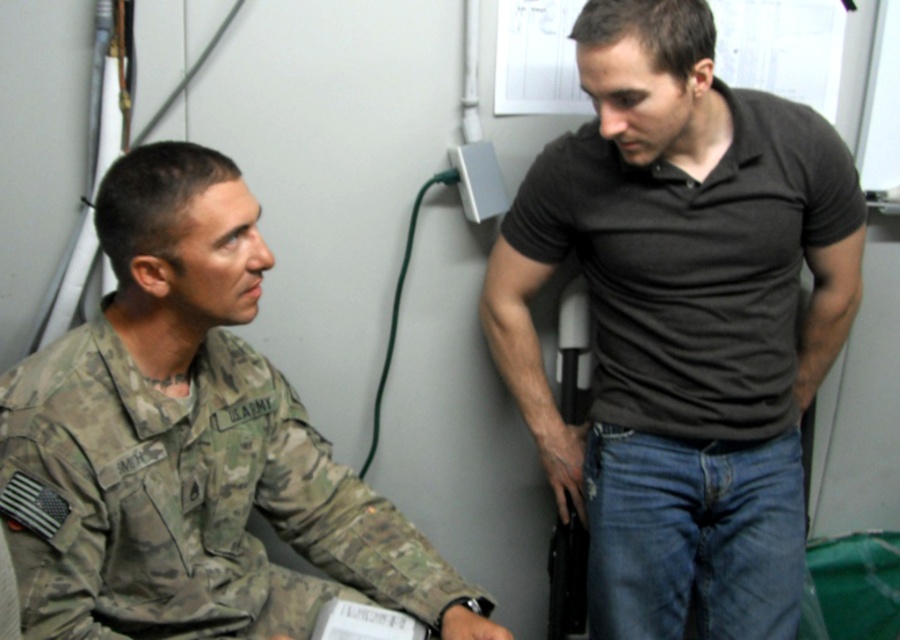
You are standing in the office and want to place a small potted plant at point (682, 323). What object will the plant be placed on?

The small potted plant will be placed on the black cotton shirt at center located at point (682, 323).

You are a photographer setting up a photo shoot in the office described. You need to position a spotlight so that it illuminates both the black cotton shirt at center and the camouflage uniform at left equally. Given their height difference, where should you place the spotlight relative to the two subjects?

The black cotton shirt at center is much taller than the camouflage uniform at left, so the spotlight should be placed higher above the black cotton shirt at center to ensure both receive equal illumination.

You are standing in the office and want to place a small potted plant between the two points labeled as point (743,385) and point (270,387). Which point should the plant be closer to in order to be closer to the camera?

The plant should be closer to point (743,385) because it is further to the camera than point (270,387).